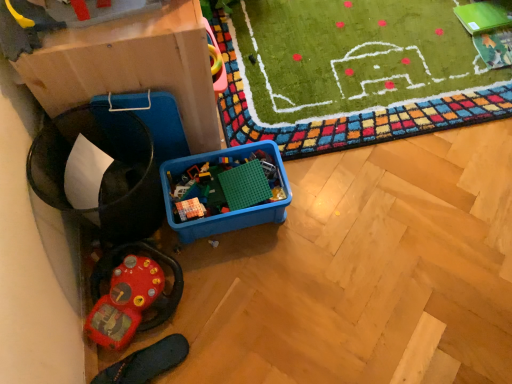
This screenshot has width=512, height=384. Identify the location of black rubber slipper at lower left. (146, 362).

What do you see at coordinates (131, 66) in the screenshot? I see `matte cardboard box at left` at bounding box center [131, 66].

Where is `blue plastic container at center, which ranks as the 2th toy in left-to-right order`? Image resolution: width=512 pixels, height=384 pixels. blue plastic container at center, which ranks as the 2th toy in left-to-right order is located at coordinates (207, 169).

Image resolution: width=512 pixels, height=384 pixels. What are the coordinates of `black rubber slipper at lower left` in the screenshot? It's located at (146, 362).

From a real-world perspective, is blue plastic container at center, the 1th toy in the top-to-bottom sequence, above or below matte cardboard box at left?

blue plastic container at center, the 1th toy in the top-to-bottom sequence, is below matte cardboard box at left.

Can you tell me how much blue plastic container at center, placed as the first toy when sorted from right to left, and matte cardboard box at left differ in facing direction?

The facing directions of blue plastic container at center, placed as the first toy when sorted from right to left, and matte cardboard box at left are 2.94 degrees apart.

Who is smaller, blue plastic container at center, the 1th toy in the top-to-bottom sequence, or matte cardboard box at left?

blue plastic container at center, the 1th toy in the top-to-bottom sequence.

From the image's perspective, relative to rubberized red steering wheel at lower left, which appears as the second toy when viewed from the right, is matte cardboard box at left above or below?

From the image's perspective, matte cardboard box at left appears above rubberized red steering wheel at lower left, which appears as the second toy when viewed from the right.

Would you say matte cardboard box at left contains rubberized red steering wheel at lower left, which appears as the second toy when viewed from the right?

Definitely not — rubberized red steering wheel at lower left, which appears as the second toy when viewed from the right, is not inside matte cardboard box at left.

Looking at this image, from a real-world perspective, relative to rubberized red steering wheel at lower left, acting as the 1th toy starting from the left, is matte cardboard box at left vertically above or below?

From a real-world perspective, matte cardboard box at left is physically above rubberized red steering wheel at lower left, acting as the 1th toy starting from the left.

How distant is matte cardboard box at left from rubberized red steering wheel at lower left, acting as the 1th toy starting from the left?

matte cardboard box at left and rubberized red steering wheel at lower left, acting as the 1th toy starting from the left, are 48.48 centimeters apart from each other.

Considering the sizes of objects matte cardboard box at left and blue plastic container at center, placed as the first toy when sorted from right to left, in the image provided, who is taller, matte cardboard box at left or blue plastic container at center, placed as the first toy when sorted from right to left,?

matte cardboard box at left is taller.

Based on the photo, how many degrees apart are the facing directions of matte cardboard box at left and blue plastic container at center, which is the 2th toy in bottom-to-top order?

They differ by 2.94 degrees in their facing directions.

Is blue plastic container at center, which is the 2th toy in bottom-to-top order, at the back of matte cardboard box at left?

No, blue plastic container at center, which is the 2th toy in bottom-to-top order, is not at the back of matte cardboard box at left.

Does matte cardboard box at left touch blue plastic container at center, the 1th toy in the top-to-bottom sequence?

They are not placed beside each other.

Is the position of black rubber slipper at lower left more distant than that of matte cardboard box at left?

Yes, black rubber slipper at lower left is further from the viewer.

Would you consider black rubber slipper at lower left to be distant from matte cardboard box at left?

They are positioned close to each other.

From the image's perspective, is black rubber slipper at lower left below matte cardboard box at left?

Yes, from the image's perspective, black rubber slipper at lower left is beneath matte cardboard box at left.

Do you think rubberized red steering wheel at lower left, which ranks as the first toy in bottom-to-top order, is within blue plastic container at center, the 1th toy in the top-to-bottom sequence, or outside of it?

rubberized red steering wheel at lower left, which ranks as the first toy in bottom-to-top order, is outside blue plastic container at center, the 1th toy in the top-to-bottom sequence.

Is rubberized red steering wheel at lower left, acting as the 1th toy starting from the left, positioned with its back to blue plastic container at center, the 1th toy in the top-to-bottom sequence?

No, rubberized red steering wheel at lower left, acting as the 1th toy starting from the left,'s orientation is not away from blue plastic container at center, the 1th toy in the top-to-bottom sequence.

Considering the positions of objects rubberized red steering wheel at lower left, which ranks as the first toy in bottom-to-top order, and blue plastic container at center, placed as the first toy when sorted from right to left, in the image provided, who is in front, rubberized red steering wheel at lower left, which ranks as the first toy in bottom-to-top order, or blue plastic container at center, placed as the first toy when sorted from right to left,?

rubberized red steering wheel at lower left, which ranks as the first toy in bottom-to-top order, is closer to the camera.

How different are the orientations of rubberized red steering wheel at lower left, acting as the 1th toy starting from the left, and blue plastic container at center, the 1th toy in the top-to-bottom sequence, in degrees?

The facing directions of rubberized red steering wheel at lower left, acting as the 1th toy starting from the left, and blue plastic container at center, the 1th toy in the top-to-bottom sequence, are 51.5 degrees apart.

Consider the image. Which is nearer, (239,157) or (170,360)?

Point (239,157) is farther from the camera than point (170,360).

Is black rubber slipper at lower left inside blue plastic container at center, which is the 2th toy in bottom-to-top order?

No, black rubber slipper at lower left is not surrounded by blue plastic container at center, which is the 2th toy in bottom-to-top order.

Image resolution: width=512 pixels, height=384 pixels. Identify the location of the 2nd toy directly above the black rubber slipper at lower left (from a real-world perspective). (207, 169).

From a real-world perspective, between black rubber slipper at lower left and blue plastic container at center, placed as the first toy when sorted from right to left, who is vertically lower?

In real-world perspective, black rubber slipper at lower left is lower.

Is black rubber slipper at lower left positioned far away from blue plastic container at center, placed as the first toy when sorted from right to left?

black rubber slipper at lower left is actually quite close to blue plastic container at center, placed as the first toy when sorted from right to left.

Is black rubber slipper at lower left turned away from blue plastic container at center, placed as the first toy when sorted from right to left?

No, black rubber slipper at lower left is not facing the opposite direction of blue plastic container at center, placed as the first toy when sorted from right to left.

Considering the positions of points (105, 379) and (276, 204), is point (105, 379) farther from camera compared to point (276, 204)?

No, (105, 379) is closer to viewer.

From a real-world perspective, which toy is the 1st one underneath the matte cardboard box at left? Please provide its 2D coordinates.

[(207, 169)]

This screenshot has height=384, width=512. What are the coordinates of `cardboard box that is on the left side of rubberized red steering wheel at lower left, arranged as the 2th toy when viewed from the top` in the screenshot? It's located at (131, 66).

From the image, which object appears to be nearer to matte cardboard box at left, black rubber slipper at lower left or rubberized red steering wheel at lower left, acting as the 1th toy starting from the left?

rubberized red steering wheel at lower left, acting as the 1th toy starting from the left.

Estimate the real-world distances between objects in this image. Which object is closer to blue plastic container at center, which ranks as the 2th toy in left-to-right order, matte cardboard box at left or black rubber slipper at lower left?

Based on the image, matte cardboard box at left appears to be nearer to blue plastic container at center, which ranks as the 2th toy in left-to-right order.

Estimate the real-world distances between objects in this image. Which object is closer to black rubber slipper at lower left, matte cardboard box at left or rubberized red steering wheel at lower left, which ranks as the first toy in bottom-to-top order?

rubberized red steering wheel at lower left, which ranks as the first toy in bottom-to-top order, lies closer to black rubber slipper at lower left than the other object.

Based on their spatial positions, is matte cardboard box at left or blue plastic container at center, which is the 2th toy in bottom-to-top order, closer to rubberized red steering wheel at lower left, arranged as the 2th toy when viewed from the top?

blue plastic container at center, which is the 2th toy in bottom-to-top order, lies closer to rubberized red steering wheel at lower left, arranged as the 2th toy when viewed from the top, than the other object.

Looking at the image, which one is located further to matte cardboard box at left, blue plastic container at center, which is the 2th toy in bottom-to-top order, or black rubber slipper at lower left?

black rubber slipper at lower left is further to matte cardboard box at left.

Estimate the real-world distances between objects in this image. Which object is further from matte cardboard box at left, blue plastic container at center, which is the 2th toy in bottom-to-top order, or rubberized red steering wheel at lower left, which appears as the second toy when viewed from the right?

rubberized red steering wheel at lower left, which appears as the second toy when viewed from the right.

From the image, which object appears to be nearer to rubberized red steering wheel at lower left, acting as the 1th toy starting from the left, blue plastic container at center, which ranks as the 2th toy in left-to-right order, or black rubber slipper at lower left?

black rubber slipper at lower left.

In the scene shown: From the image, which object appears to be farther from black rubber slipper at lower left, matte cardboard box at left or blue plastic container at center, placed as the first toy when sorted from right to left?

matte cardboard box at left.

Find the location of a particular element. The image size is (512, 384). toy between blue plastic container at center, which ranks as the 2th toy in left-to-right order, and black rubber slipper at lower left vertically is located at coordinates (130, 294).

At what (x,y) coordinates should I click in order to perform the action: click on toy between matte cardboard box at left and rubberized red steering wheel at lower left, acting as the 1th toy starting from the left, from top to bottom. Please return your answer as a coordinate pair (x, y). The image size is (512, 384). Looking at the image, I should click on (207, 169).